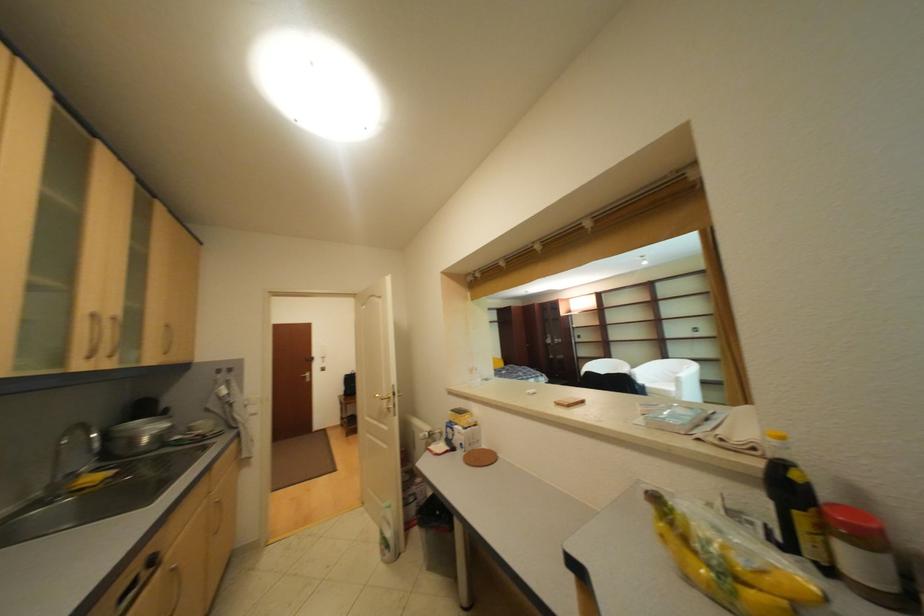
Describe the element at coordinates (82, 246) in the screenshot. I see `the lower cabinet handle` at that location.